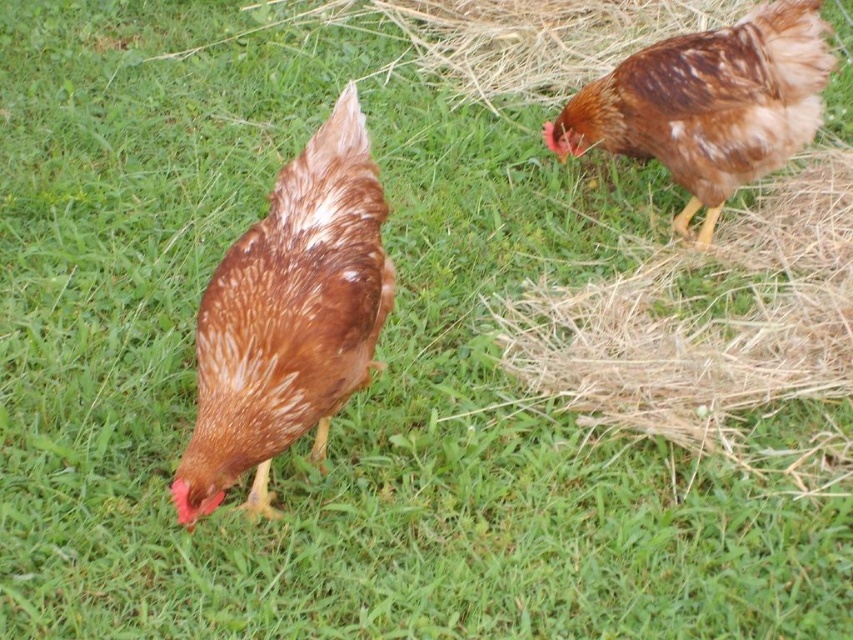
Question: Which object is positioned closest to the brown speckled feather at center?

Choices:
 (A) brown straw at upper right
 (B) brown speckled feather at upper right

Answer: (A)

Question: Does brown speckled feather at center appear on the right side of brown speckled feather at upper right?

Choices:
 (A) yes
 (B) no

Answer: (B)

Question: Estimate the real-world distances between objects in this image. Which object is closer to the brown straw at upper right?

Choices:
 (A) brown speckled feather at center
 (B) brown speckled feather at upper right

Answer: (B)

Question: In this image, where is brown speckled feather at center located relative to brown speckled feather at upper right?

Choices:
 (A) below
 (B) above

Answer: (A)

Question: Is brown speckled feather at center positioned before brown speckled feather at upper right?

Choices:
 (A) no
 (B) yes

Answer: (B)

Question: Which point appears farthest from the camera in this image?

Choices:
 (A) coord(631,116)
 (B) coord(799,396)
 (C) coord(177,474)

Answer: (A)